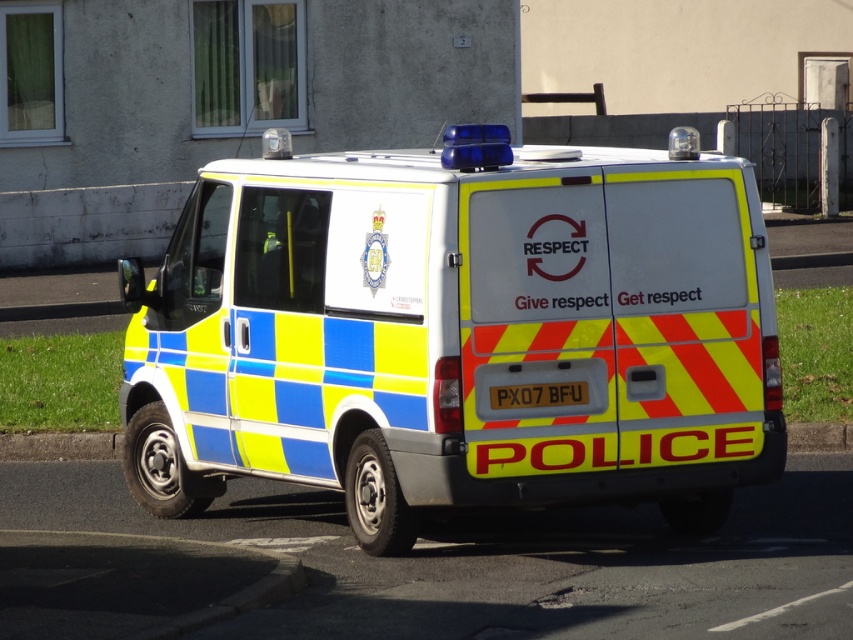
The width and height of the screenshot is (853, 640). Describe the element at coordinates (457, 332) in the screenshot. I see `yellow and blue checkered police van at center` at that location.

From the picture: Which is above, yellow and blue checkered police van at center or yellow reflective plate at center?

Positioned higher is yellow and blue checkered police van at center.

Does point (380, 400) come in front of point (544, 385)?

That is False.

What are the coordinates of `yellow and blue checkered police van at center` in the screenshot? It's located at (457, 332).